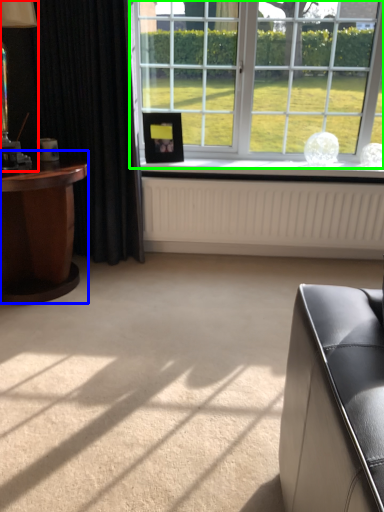
Question: Which is nearer to the table lamp (highlighted by a red box)? table (highlighted by a blue box) or window (highlighted by a green box).

Choices:
 (A) table
 (B) window

Answer: (A)